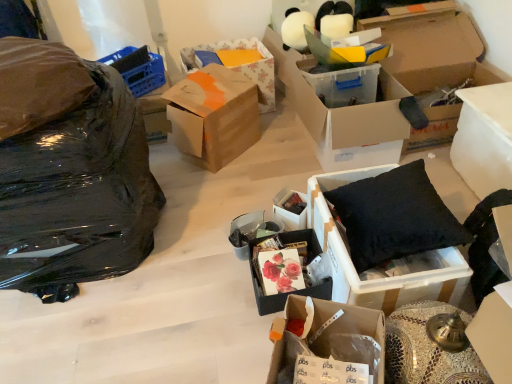
Question: Is there a large distance between transparent plastic box at center, which ranks as the 3th box in right-to-left order, and cardboard box at center, which is the 5th box in left-to-right order?

Choices:
 (A) yes
 (B) no

Answer: (A)

Question: From a real-world perspective, does transparent plastic box at center, acting as the seventh box starting from the left, stand above cardboard box at center, the 5th box in the right-to-left sequence?

Choices:
 (A) yes
 (B) no

Answer: (A)

Question: From the image's perspective, does transparent plastic box at center, acting as the seventh box starting from the left, appear higher than cardboard box at center, the 5th box in the right-to-left sequence?

Choices:
 (A) no
 (B) yes

Answer: (B)

Question: Is transparent plastic box at center, acting as the seventh box starting from the left, turned away from cardboard box at center, the 5th box in the right-to-left sequence?

Choices:
 (A) no
 (B) yes

Answer: (A)

Question: Does transparent plastic box at center, which ranks as the 3th box in right-to-left order, come in front of cardboard box at center, the 5th box in the right-to-left sequence?

Choices:
 (A) yes
 (B) no

Answer: (B)

Question: Is point (313, 286) closer or farther from the camera than point (365, 309)?

Choices:
 (A) closer
 (B) farther

Answer: (B)

Question: Is matte floral print box at center, the third box in the left-to-right sequence, in front of or behind cardboard box at center, which is the 5th box in left-to-right order, in the image?

Choices:
 (A) behind
 (B) front

Answer: (A)

Question: Would you say matte floral print box at center, the third box in the left-to-right sequence, is inside or outside cardboard box at center, which is the 5th box in left-to-right order?

Choices:
 (A) outside
 (B) inside

Answer: (A)

Question: From their relative heights in the image, would you say matte floral print box at center, acting as the seventh box starting from the right, is taller or shorter than cardboard box at center, the 5th box in the right-to-left sequence?

Choices:
 (A) short
 (B) tall

Answer: (A)

Question: Considering the positions of point (23, 190) and point (482, 107), is point (23, 190) closer or farther from the camera than point (482, 107)?

Choices:
 (A) farther
 (B) closer

Answer: (B)

Question: From the image's perspective, is black plastic bag at left located above or below white plastic container at right, which is the 1th box in right-to-left order?

Choices:
 (A) above
 (B) below

Answer: (B)

Question: Considering their positions, is black plastic bag at left located in front of or behind white plastic container at right, which is the 1th box in right-to-left order?

Choices:
 (A) behind
 (B) front

Answer: (B)

Question: From a real-world perspective, is black plastic bag at left above or below white plastic container at right, the ninth box positioned from the left?

Choices:
 (A) below
 (B) above

Answer: (B)

Question: Visually, is matte black box at center, the sixth box positioned from the right, positioned to the left or to the right of black fabric cushion at right, the 4th box positioned from the right?

Choices:
 (A) left
 (B) right

Answer: (A)

Question: Considering the positions of point (279, 216) and point (411, 299), is point (279, 216) closer or farther from the camera than point (411, 299)?

Choices:
 (A) farther
 (B) closer

Answer: (A)